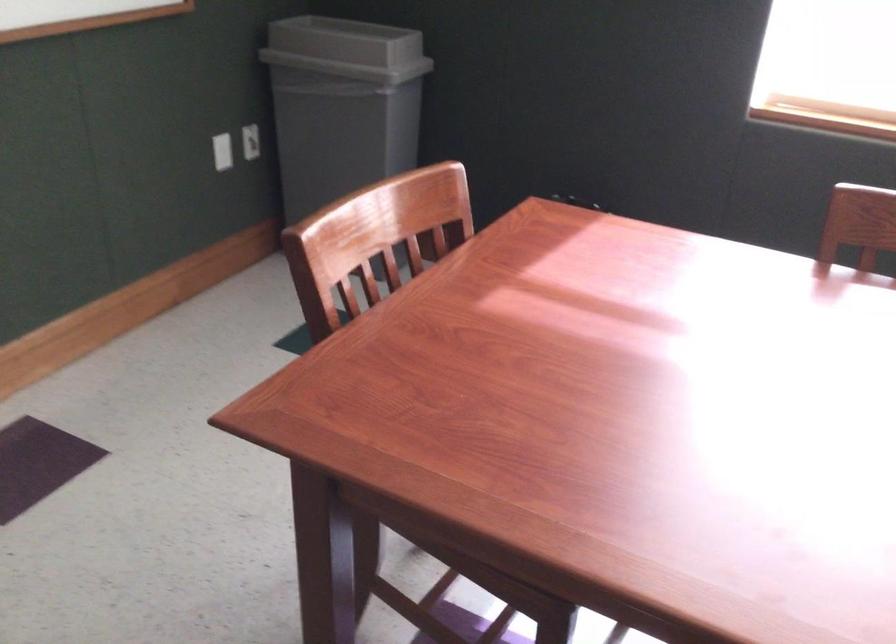
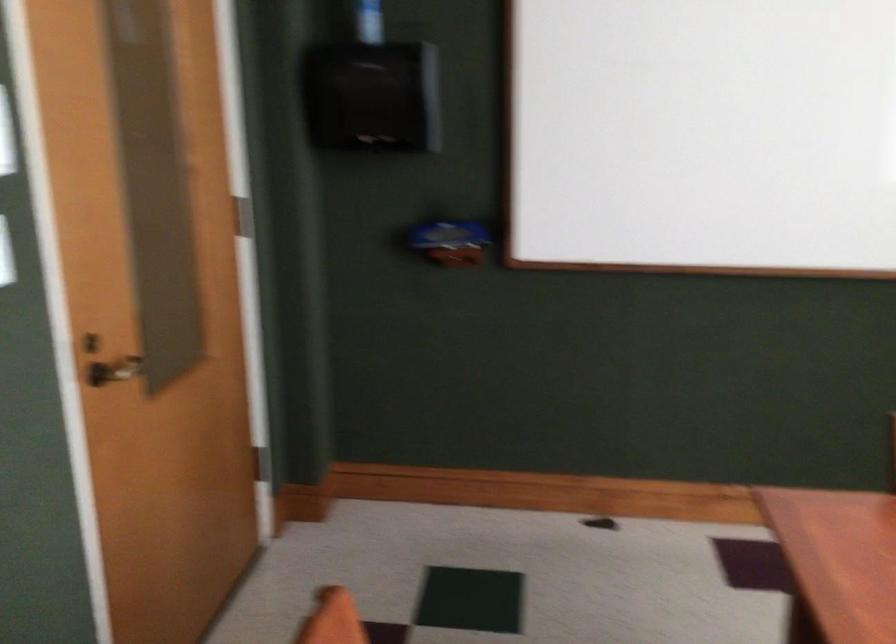
Question: The first image is from the beginning of the video and the second image is from the end. How did the camera likely rotate when shooting the video?

Choices:
 (A) Left
 (B) Right
 (C) Up
 (D) Down

Answer: (A)